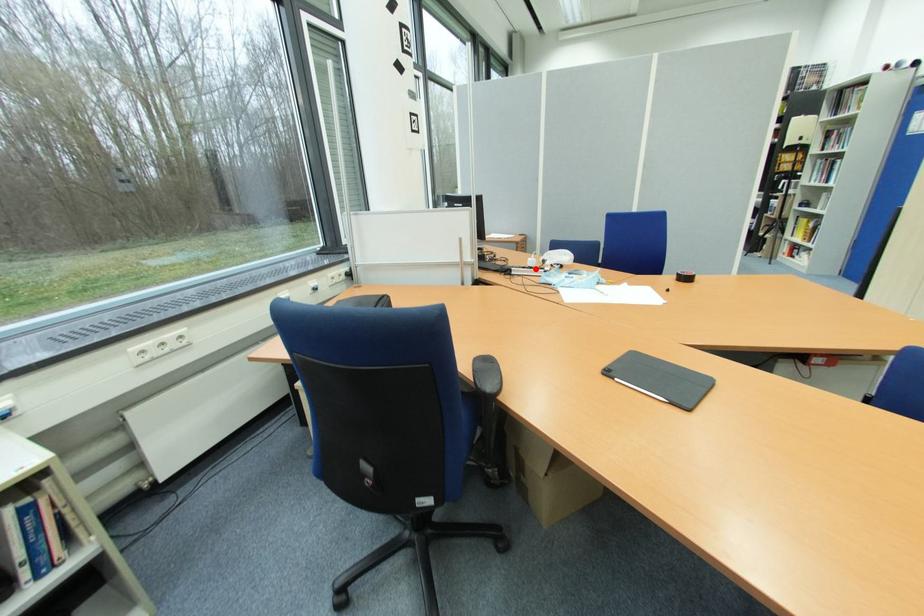
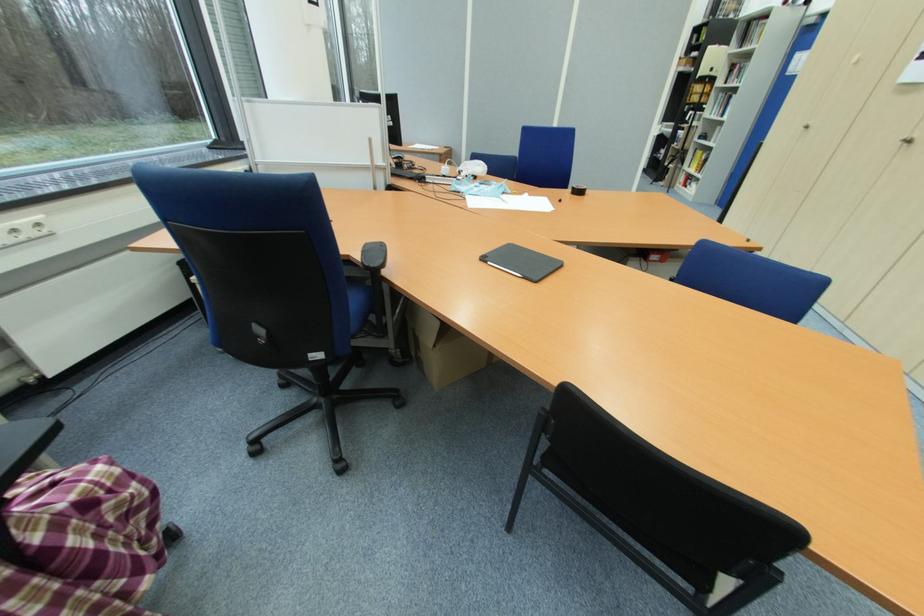
Locate, in the second image, the point that corresponds to the highlighted location in the first image.

(447, 177)